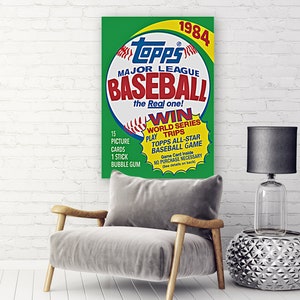
Find the location of a particular element. This screenshot has height=300, width=300. chair is located at coordinates (158, 205).